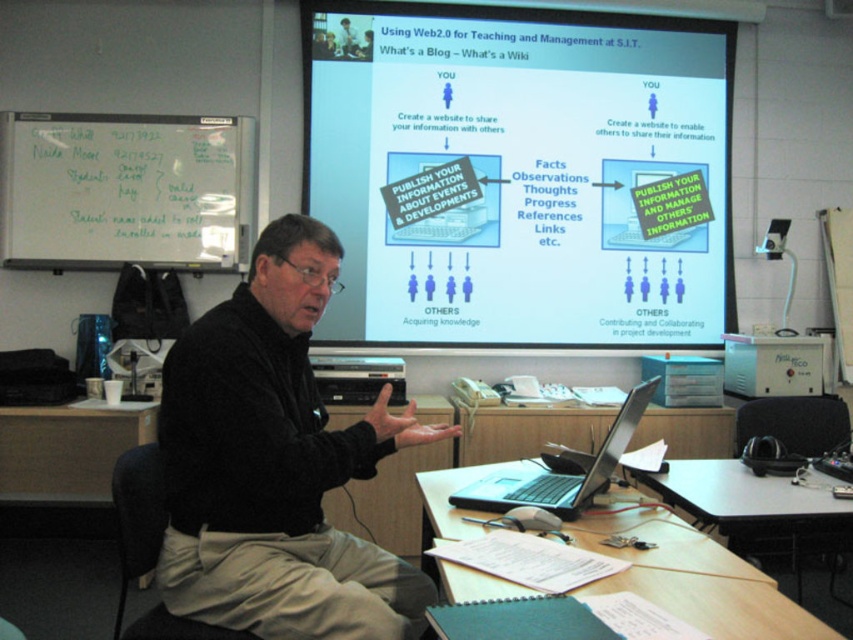
Is whiteboard at left positioned behind wooden desk at lower left?

Yes, it is behind wooden desk at lower left.

Is whiteboard at left to the left of wooden desk at lower left from the viewer's perspective?

Incorrect, whiteboard at left is not on the left side of wooden desk at lower left.

Measure the distance between point (161, 176) and camera.

3.93 meters

Find the location of a particular element. The width and height of the screenshot is (853, 640). whiteboard at left is located at coordinates (126, 192).

Can you confirm if white matte projection screen at upper center is smaller than wooden desk at lower left?

No, white matte projection screen at upper center is not smaller than wooden desk at lower left.

Is point (335, 336) closer to viewer compared to point (10, 445)?

No, (335, 336) is further to viewer.

I want to click on white matte projection screen at upper center, so click(520, 173).

Locate an element on the screen. The height and width of the screenshot is (640, 853). white matte projection screen at upper center is located at coordinates (520, 173).

Does point (9, 496) come in front of point (527, 484)?

No, it is behind (527, 484).

Can you confirm if wooden desk at lower left is positioned above silver/black plastic laptop at lower center?

Incorrect, wooden desk at lower left is not positioned above silver/black plastic laptop at lower center.

Is point (77, 416) behind point (535, 493)?

Yes.

The width and height of the screenshot is (853, 640). I want to click on wooden desk at lower left, so click(68, 449).